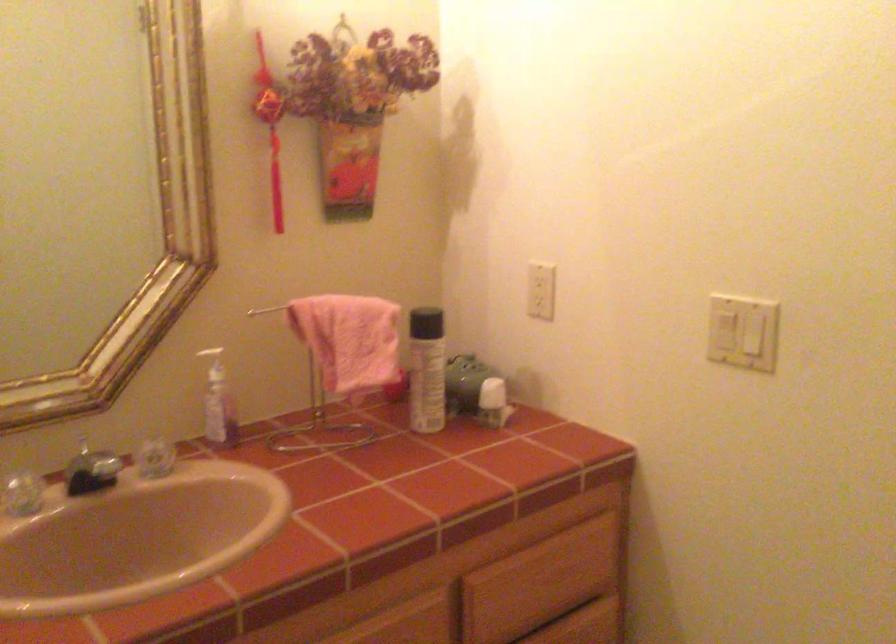
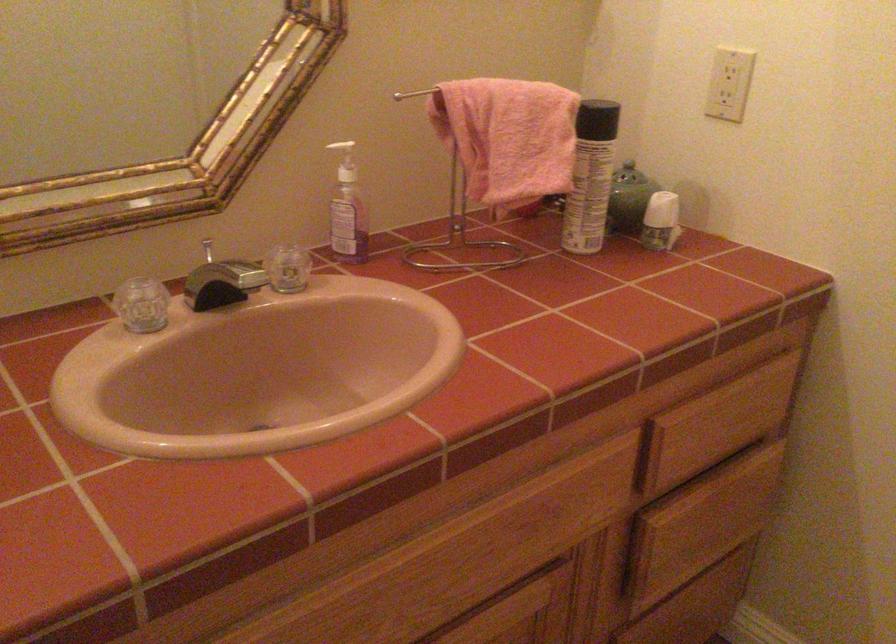
The point at (96, 444) is marked in the first image. Where is the corresponding point in the second image?

(208, 250)